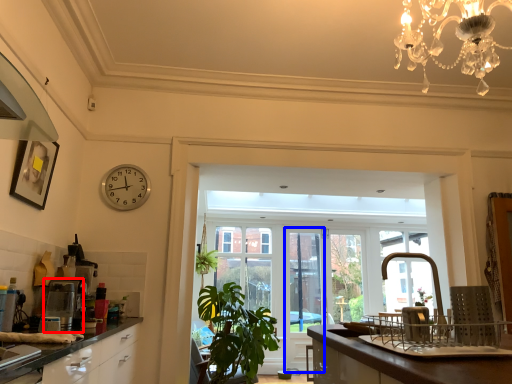
Question: Which of the following is the farthest to the observer, coffee machine (highlighted by a red box) or screen door (highlighted by a blue box)?

Choices:
 (A) coffee machine
 (B) screen door

Answer: (B)